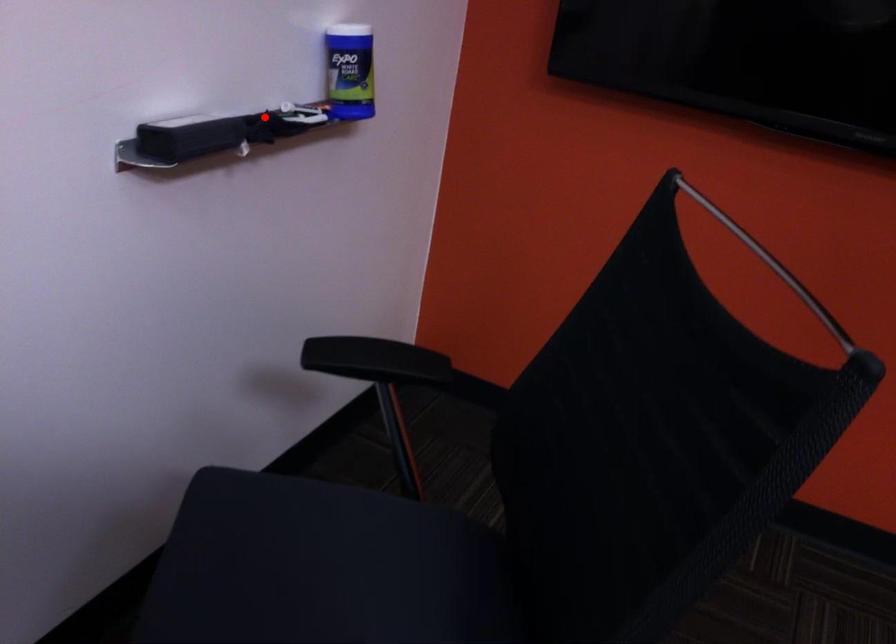
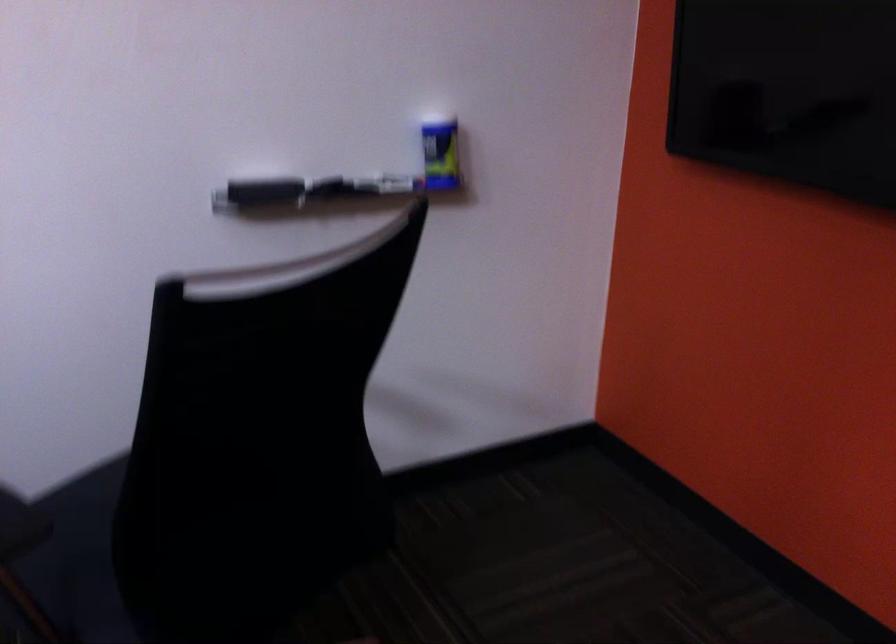
Question: A red point is marked in image1. In image2, is the corresponding 3D point closer to the camera or farther? Reply with the corresponding letter.

Choices:
 (A) The corresponding 3D point is closer.
 (B) The corresponding 3D point is farther.

Answer: (B)